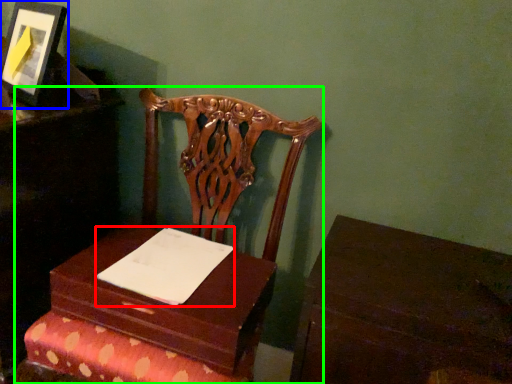
Question: Which is farther away from notepad (highlighted by a red box)? picture frame (highlighted by a blue box) or furniture (highlighted by a green box)?

Choices:
 (A) picture frame
 (B) furniture

Answer: (A)